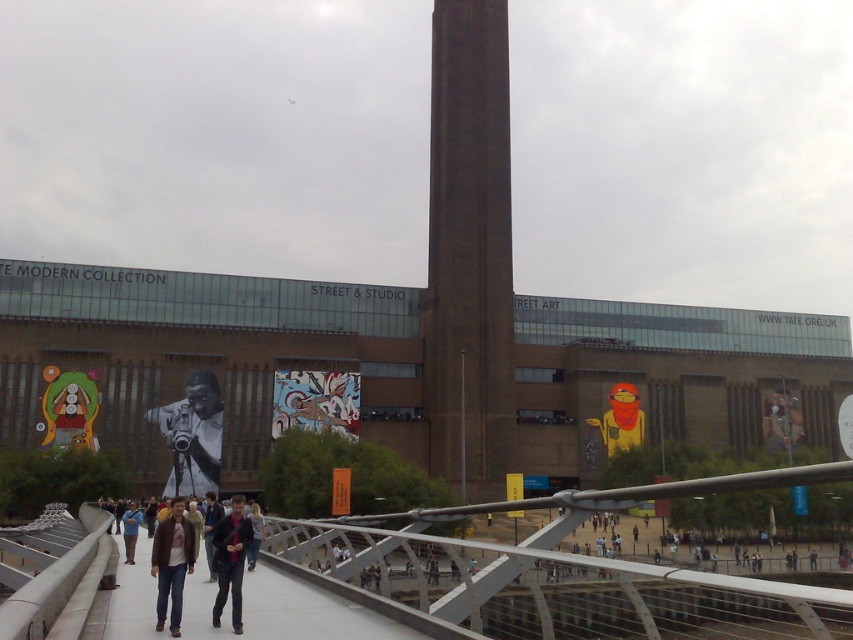
Where is `brown brick tower at center`? brown brick tower at center is located at coordinates (469, 248).

Locate an element on the screen. brown brick tower at center is located at coordinates (469, 248).

Does brown leather jacket at center appear over dark blue jeans at center?

Yes, brown leather jacket at center is above dark blue jeans at center.

Between brown leather jacket at center and dark blue jeans at center, which one has less height?

brown leather jacket at center

This screenshot has width=853, height=640. In order to click on brown leather jacket at center in this screenshot , I will do `click(183, 579)`.

Is blue denim jacket at center to the left of dark brown leather jacket at center from the viewer's perspective?

Correct, you'll find blue denim jacket at center to the left of dark brown leather jacket at center.

Does point (136, 506) come behind point (260, 532)?

Yes.

What are the coordinates of `blue denim jacket at center` in the screenshot? It's located at (131, 529).